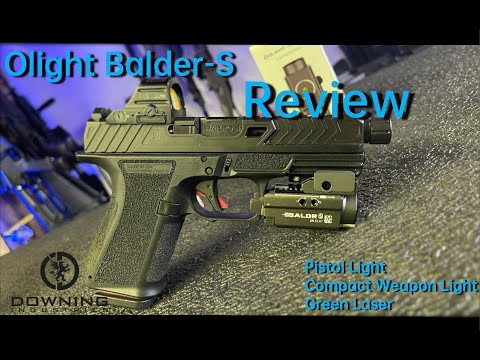
Identify the location of handle. (141, 236).